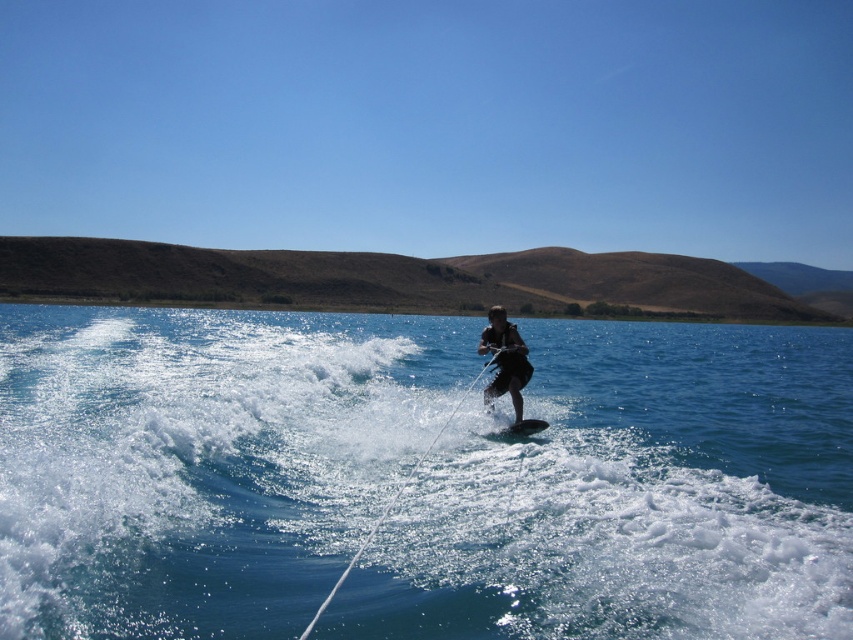
Question: Which point is closer to the camera?

Choices:
 (A) (485, 339)
 (B) (508, 429)
 (C) (489, 504)

Answer: (C)

Question: Is dark blue wetsuit at center bigger than black rubber surfboard at center?

Choices:
 (A) yes
 (B) no

Answer: (A)

Question: In this image, where is clear blue water at center located relative to black rubber surfboard at center?

Choices:
 (A) below
 (B) above

Answer: (B)

Question: Which object appears closest to the camera in this image?

Choices:
 (A) clear blue water at center
 (B) black rubber surfboard at center
 (C) dark blue wetsuit at center

Answer: (A)

Question: Can you confirm if clear blue water at center is positioned to the right of dark blue wetsuit at center?

Choices:
 (A) no
 (B) yes

Answer: (B)

Question: Which object is positioned closest to the black rubber surfboard at center?

Choices:
 (A) clear blue water at center
 (B) dark blue wetsuit at center

Answer: (B)